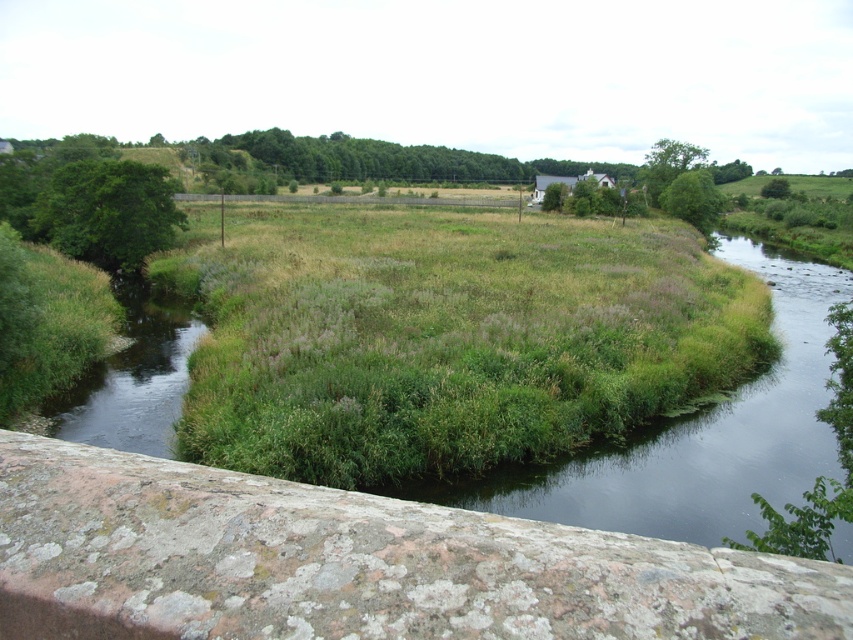
You are standing at the stone structure in the foreground of the scene. Which of the two water features, the green grassy water at center or the green grassy stream at left, would you see first as you look towards them?

The green grassy water at center is closer to the viewer than the green grassy stream at left, so you would see the green grassy water at center first.

You are a hiker who wants to cross the river. You see the green grassy water at center and the green grassy stream at left. Which one is wider so you can choose the safer path?

The green grassy water at center has a larger size compared to the green grassy stream at left, so it is wider and safer to cross.

You are standing at the stone structure in the foreground and want to reach the point labeled as point [152,454]. Is the point labeled point [373,227] closer to you or farther away than the point you want to reach?

The point labeled point [373,227] is farther away than the point labeled point [152,454] because it is positioned behind it according to the description.